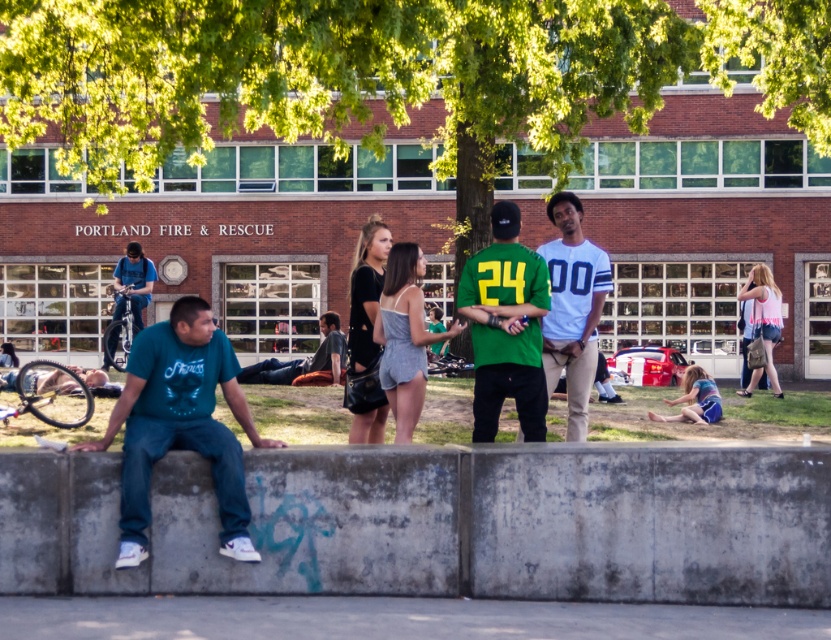
Does green leafy tree at upper center have a smaller size compared to denim shorts at lower right?

Incorrect, green leafy tree at upper center is not smaller in size than denim shorts at lower right.

Which is in front, point (815, 122) or point (687, 385)?

Point (687, 385) is in front.

This screenshot has height=640, width=831. I want to click on green leafy tree at upper center, so click(x=775, y=56).

Can you confirm if teal t-shirt at left is shorter than green leafy tree at upper center?

Indeed, teal t-shirt at left has a lesser height compared to green leafy tree at upper center.

Is point (134, 392) positioned in front of point (779, 1)?

Yes, it is in front of point (779, 1).

What do you see at coordinates (180, 422) in the screenshot? I see `teal t-shirt at left` at bounding box center [180, 422].

Image resolution: width=831 pixels, height=640 pixels. I want to click on teal t-shirt at left, so click(x=180, y=422).

Is green matte jersey at center taller than denim shorts at lower right?

Correct, green matte jersey at center is much taller as denim shorts at lower right.

Is green matte jersey at center further to the viewer compared to denim shorts at lower right?

No, it is in front of denim shorts at lower right.

Where is `green matte jersey at center`? green matte jersey at center is located at coordinates (505, 326).